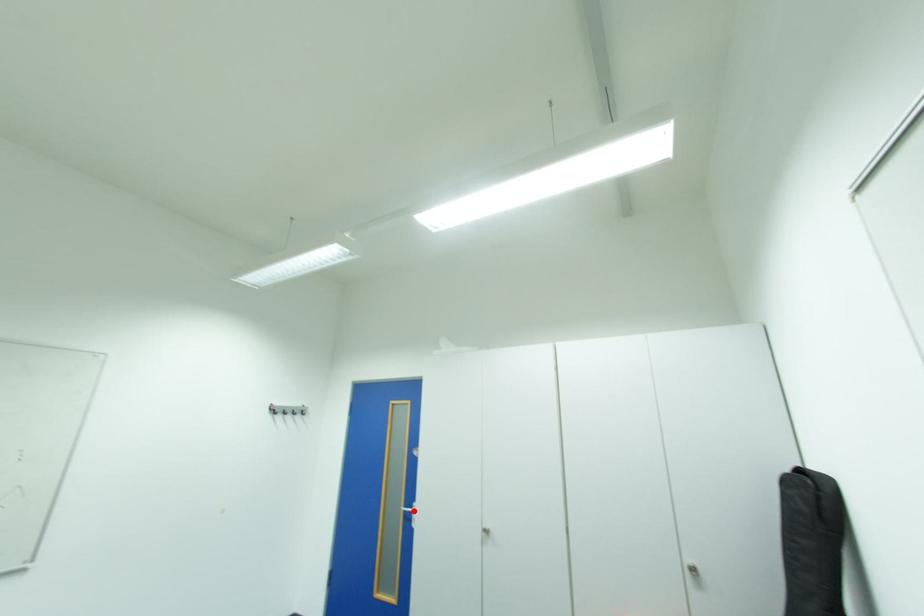
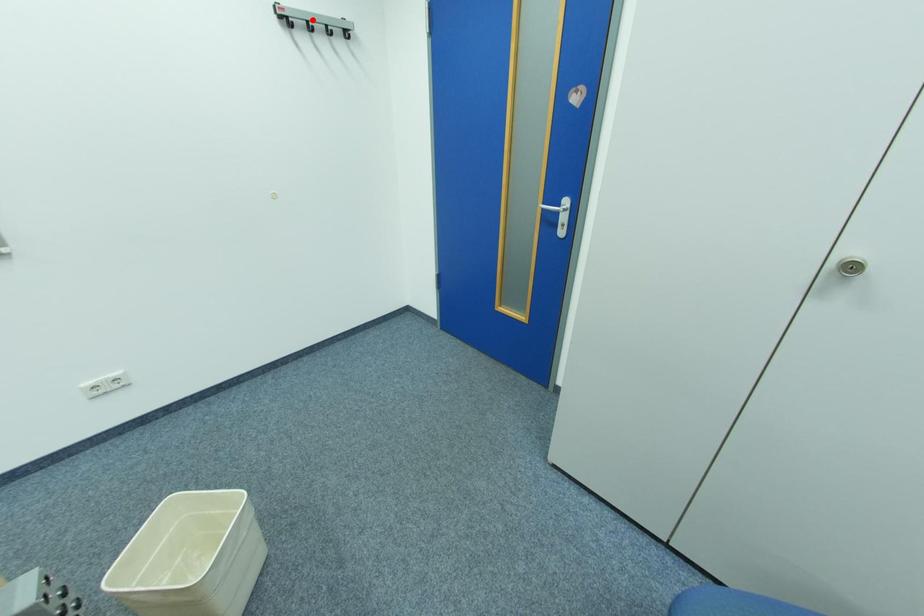
I am providing you with two images of the same scene from different viewpoints. A red point is marked on the first image and another point is marked on the second image. Do the highlighted points in image1 and image2 indicate the same real-world spot?

No